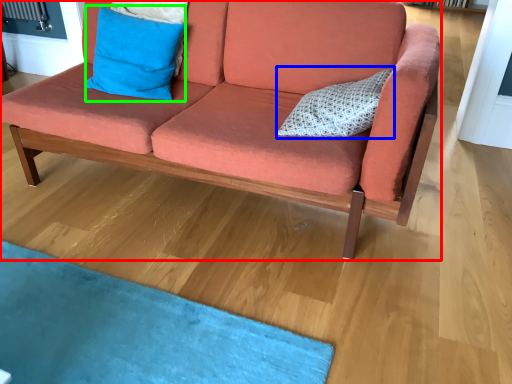
Question: Which is farther away from studio couch (highlighted by a red box)? pillow (highlighted by a blue box) or pillow (highlighted by a green box)?

Choices:
 (A) pillow
 (B) pillow

Answer: (B)